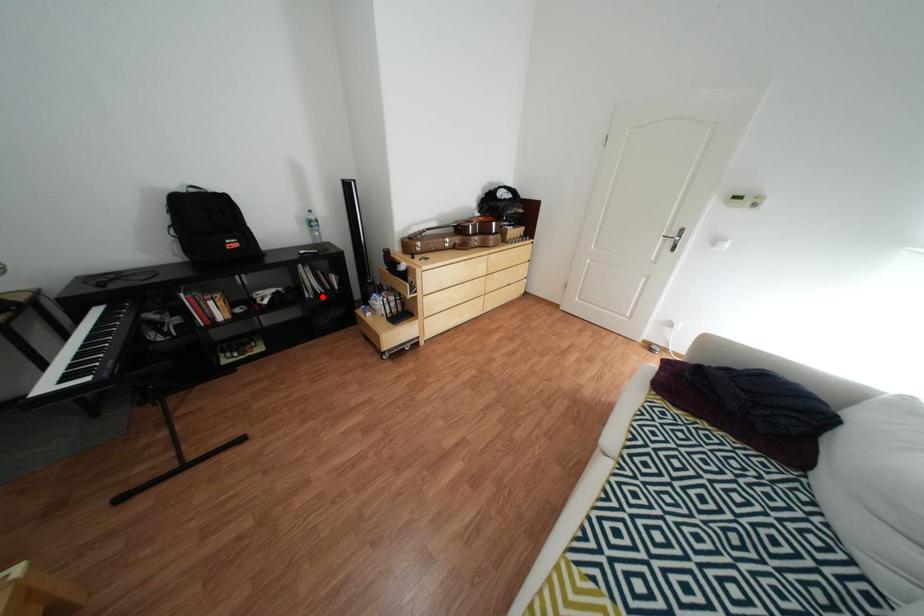
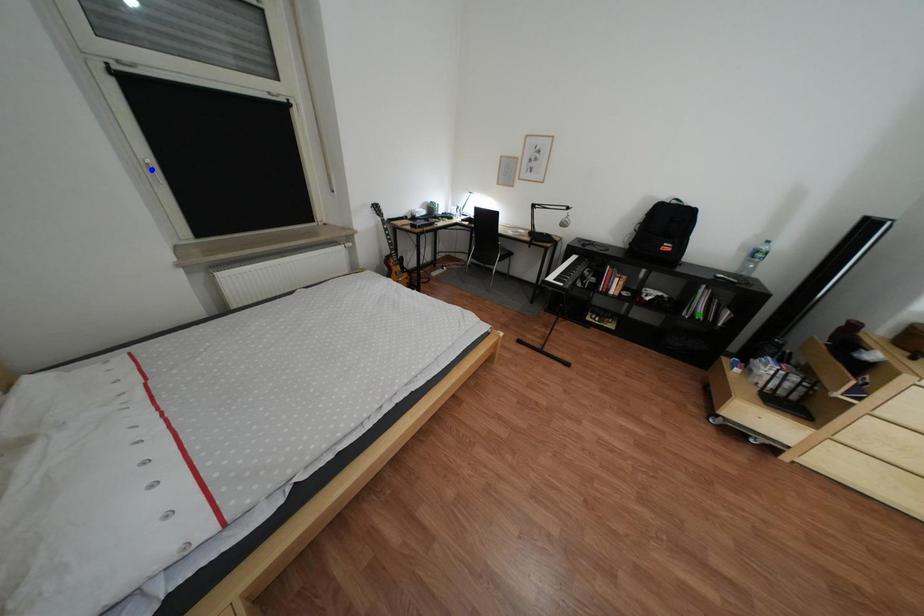
Question: I am providing you with two images of the same scene from different viewpoints. A red point is marked on the first image. You are given multiple points on the second image. Which point in image 2 is actually the same real-world point as the red point in image 1?

Choices:
 (A) yellow point
 (B) blue point
 (C) green point

Answer: (C)